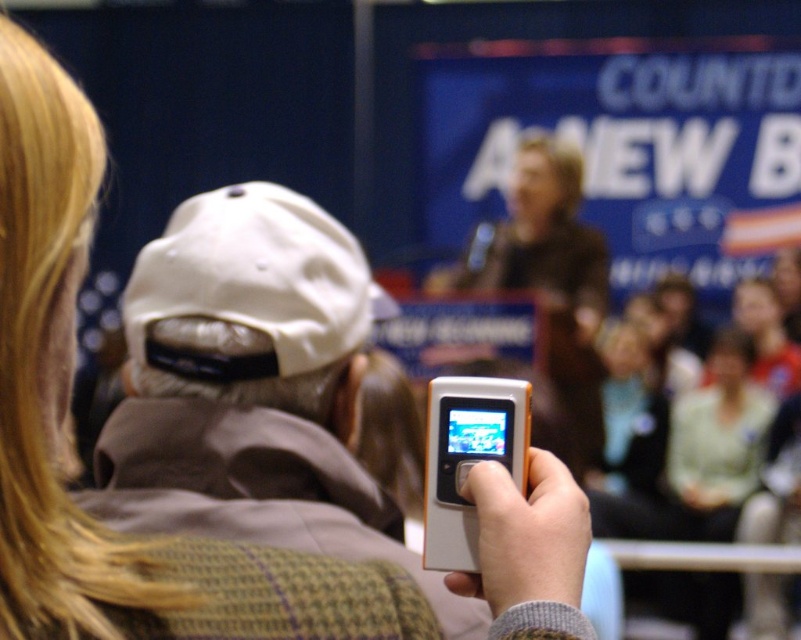
Is matte white cap at upper center to the right of white fabric baseball cap at center from the viewer's perspective?

Correct, you'll find matte white cap at upper center to the right of white fabric baseball cap at center.

Is point (252, 465) farther from camera compared to point (236, 189)?

No, it is in front of (236, 189).

The height and width of the screenshot is (640, 801). I want to click on matte white cap at upper center, so click(x=235, y=333).

Locate an element on the screen. The height and width of the screenshot is (640, 801). matte white cap at upper center is located at coordinates (235, 333).

Is point (288, 353) closer to viewer compared to point (566, 588)?

No, it is behind (566, 588).

Who is more forward, (x=329, y=241) or (x=562, y=579)?

Point (x=562, y=579) is in front.

Where is `matte white cap at upper center`? matte white cap at upper center is located at coordinates (235, 333).

Which is in front, point (300, 376) or point (429, 552)?

Point (429, 552) is more forward.

Measure the distance between white fabric cap at upper left and camera.

white fabric cap at upper left is 37.29 inches away from camera.

Where is `white fabric cap at upper left`? white fabric cap at upper left is located at coordinates (246, 356).